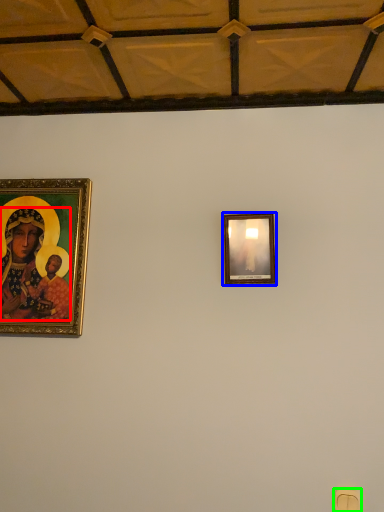
Question: Which is farther away from person (highlighted by a red box)? picture frame (highlighted by a blue box) or light switch (highlighted by a green box)?

Choices:
 (A) picture frame
 (B) light switch

Answer: (B)